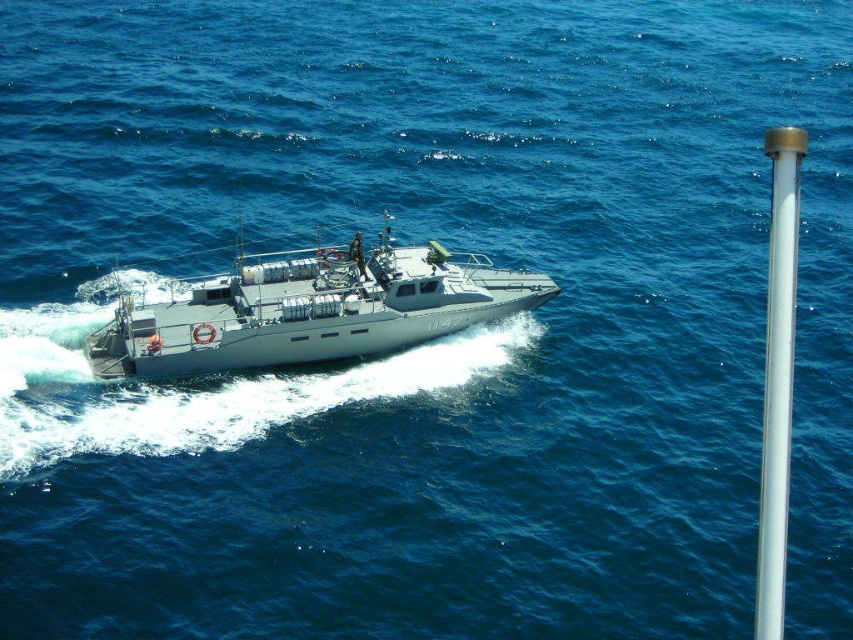
You are a photographer on a nearby ship trying to capture both the gray matte boat at center and the white glossy pole at right in a single shot. Which object should you focus on first to ensure both are in frame?

You should focus on the gray matte boat at center first because it is smaller in size compared to the white glossy pole at right, so positioning it properly will help frame both objects effectively.

You are a photographer trying to capture the gray matte boat at center and the white glossy pole at right in the same frame. Based on their heights, which object will appear smaller in your photo?

The gray matte boat at center will appear smaller in the photo because it has a lesser height compared to the white glossy pole at right.